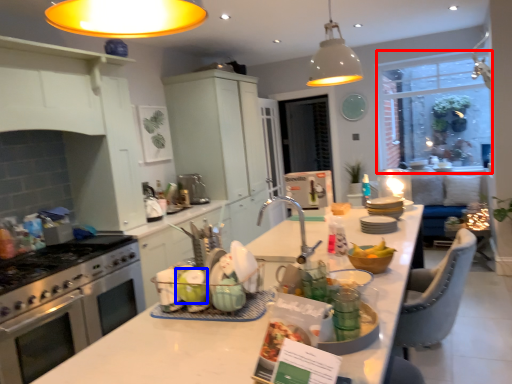
Question: Which point is further to the camera, window screen (highlighted by a red box) or table (highlighted by a blue box)?

Choices:
 (A) window screen
 (B) table

Answer: (A)